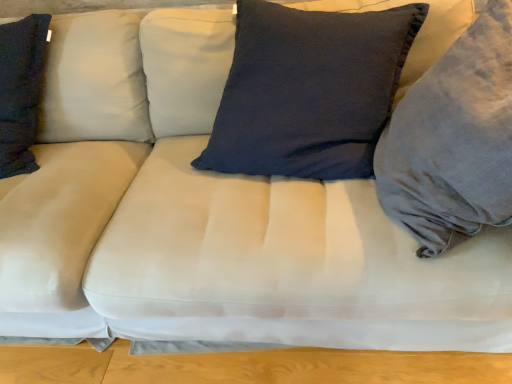
This screenshot has height=384, width=512. What do you see at coordinates (453, 140) in the screenshot?
I see `velvet gray pillow at right` at bounding box center [453, 140].

Image resolution: width=512 pixels, height=384 pixels. I want to click on velvet gray pillow at right, so click(x=453, y=140).

Locate an element on the screen. This screenshot has width=512, height=384. velvet gray pillow at right is located at coordinates (453, 140).